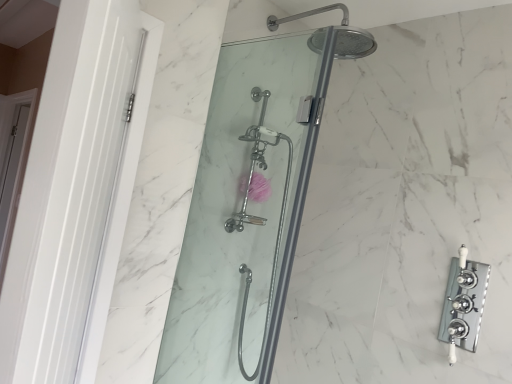
Question: Looking at the image, does white glossy door at left, marked as the 2th screen door in a left-to-right arrangement, seem bigger or smaller compared to clear glass shower door at center, which appears as the 1th shower door when viewed from the back?

Choices:
 (A) small
 (B) big

Answer: (B)

Question: Relative to clear glass shower door at center, the 2th shower door viewed from the front, is white glossy door at left, the 1th screen door when ordered from right to left, in front or behind?

Choices:
 (A) front
 (B) behind

Answer: (A)

Question: Estimate the real-world distances between objects in this image. Which object is closer to the pink fabric flower at center?

Choices:
 (A) white glossy door at left, the 2th screen door in the right-to-left sequence
 (B) white glossy door at left, which ranks as the 1th screen door in front-to-back order
 (C) chrome/polished metal faucet at right
 (D) clear glass shower door at center, which appears as the 1th shower door when viewed from the back
 (E) clear glass shower door at center, which is the second shower door in back-to-front order

Answer: (D)

Question: Considering the real-world distances, which object is farthest from the white glossy door at left, which ranks as the 1th screen door in front-to-back order?

Choices:
 (A) chrome/polished metal faucet at right
 (B) clear glass shower door at center, which appears as the 1th shower door when viewed from the back
 (C) clear glass shower door at center, placed as the first shower door when sorted from front to back
 (D) pink fabric flower at center
 (E) white glossy door at left, the 2th screen door in the right-to-left sequence

Answer: (E)